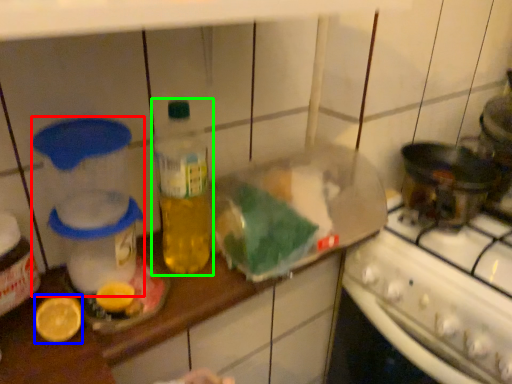
Question: Estimate the real-world distances between objects in this image. Which object is closer to appliance (highlighted by a red box), lemon (highlighted by a blue box) or bottle (highlighted by a green box)?

Choices:
 (A) lemon
 (B) bottle

Answer: (B)